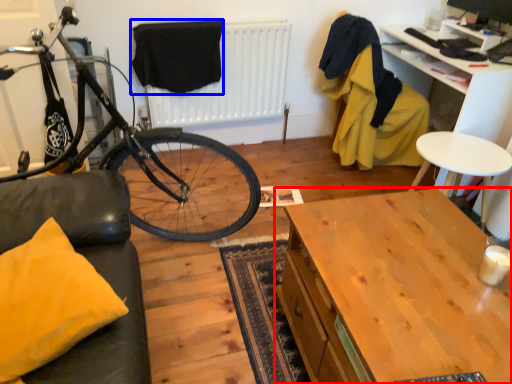
Question: Which of the following is the farthest to the observer, desk (highlighted by a red box) or clothe (highlighted by a blue box)?

Choices:
 (A) desk
 (B) clothe

Answer: (B)